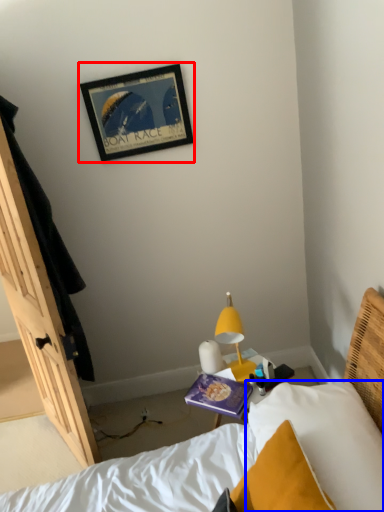
Question: Which of the following is the farthest to the observer, picture frame (highlighted by a red box) or pillow (highlighted by a blue box)?

Choices:
 (A) picture frame
 (B) pillow

Answer: (A)